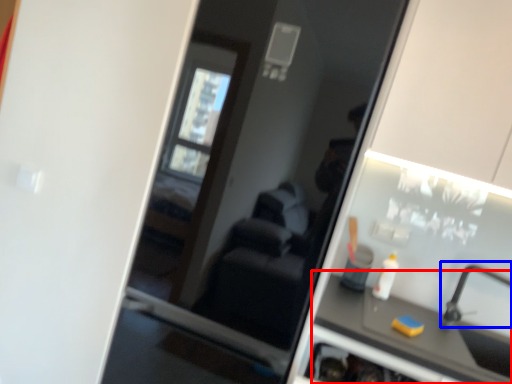
Question: Which of the following is the farthest to the observer, counter top (highlighted by a red box) or faucet (highlighted by a blue box)?

Choices:
 (A) counter top
 (B) faucet

Answer: (B)